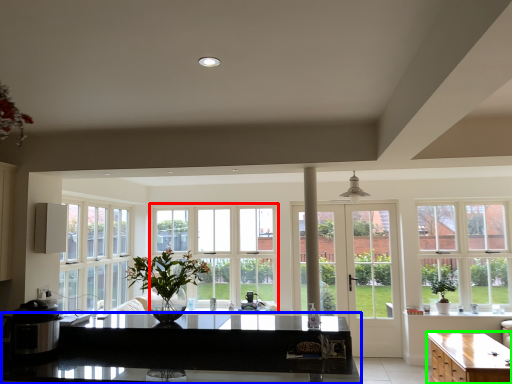
Question: Which object is positioned closest to window (highlighted by a red box)? Select from countertop (highlighted by a blue box) and cabinetry (highlighted by a green box).

Choices:
 (A) countertop
 (B) cabinetry

Answer: (A)